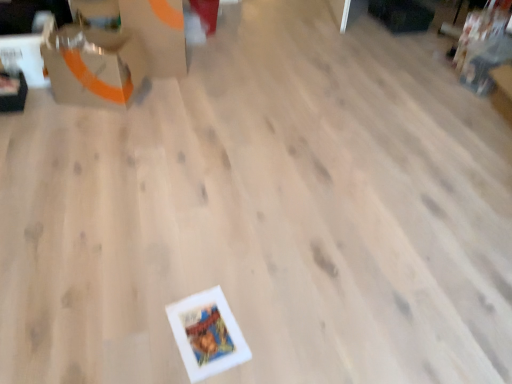
In order to click on vacant area that is in front of matte cardboard box at upper left, the second cardboard box positioned from the top in this screenshot , I will do `click(81, 132)`.